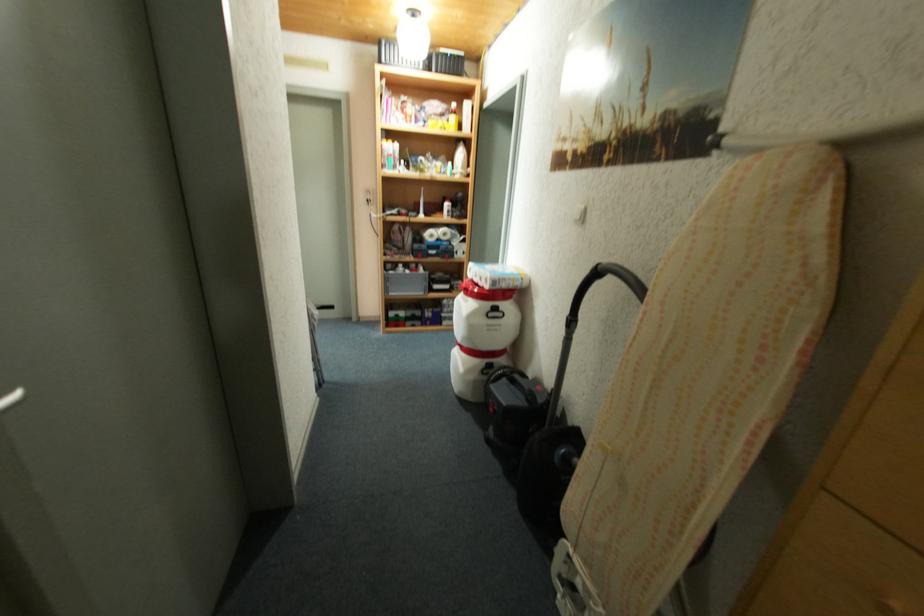
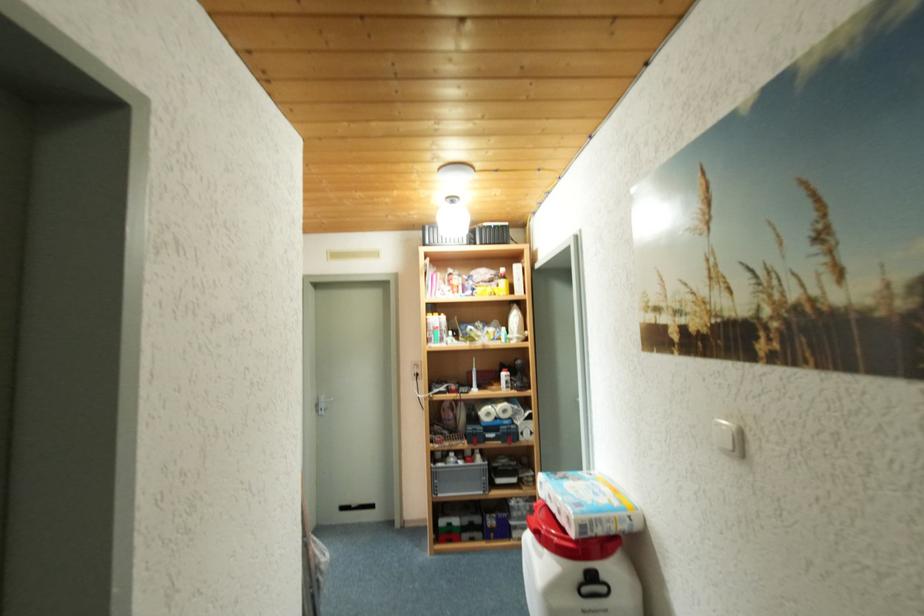
Question: In a continuous first-person perspective shot, in which direction is the camera moving?

Choices:
 (A) Left
 (B) Right
 (C) Forward
 (D) Backward

Answer: (C)